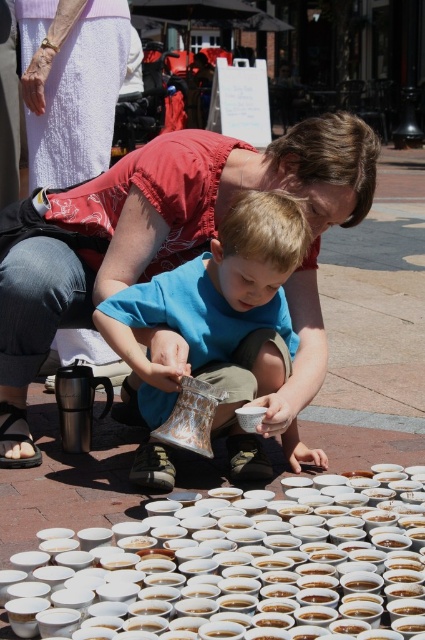
Question: Does white matte cups at lower center have a larger size compared to blue cotton shirt at center?

Choices:
 (A) yes
 (B) no

Answer: (B)

Question: Among these objects, which one is farthest from the camera?

Choices:
 (A) matte plastic bag at center
 (B) white matte cups at lower center
 (C) white textured skirt at upper left

Answer: (C)

Question: Which point is closer to the camera?

Choices:
 (A) (243, 340)
 (B) (246, 172)

Answer: (A)

Question: Does white matte cups at lower center appear under blue cotton shirt at center?

Choices:
 (A) yes
 (B) no

Answer: (A)

Question: Can you confirm if matte plastic bag at center is wider than white textured skirt at upper left?

Choices:
 (A) yes
 (B) no

Answer: (A)

Question: Which object is closer to the camera taking this photo?

Choices:
 (A) matte plastic bag at center
 (B) white matte cups at lower center
 (C) blue cotton shirt at center

Answer: (B)